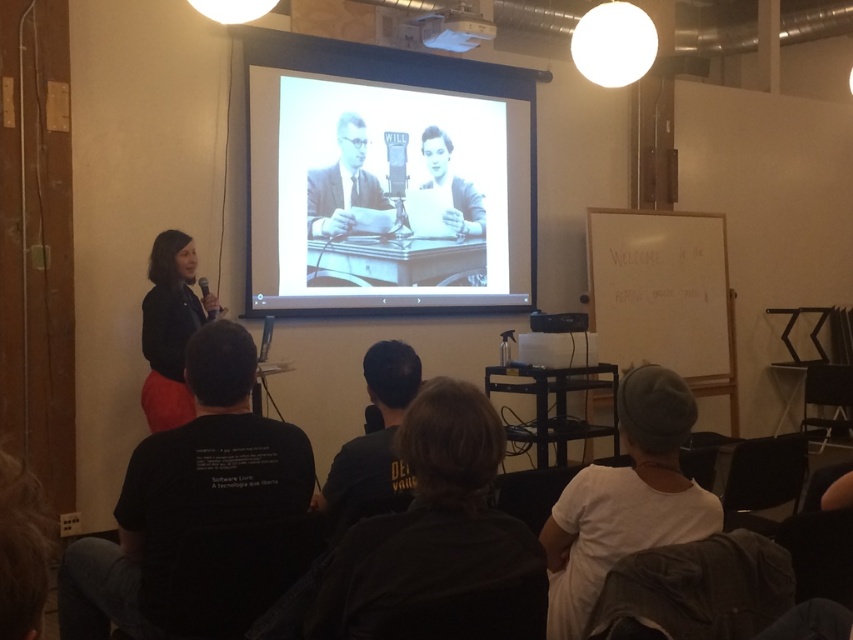
Which is more to the right, white glossy projection screen at center or matte black jacket at left?

white glossy projection screen at center

Measure the distance between white glossy projection screen at center and camera.

14.55 feet

This screenshot has width=853, height=640. I want to click on white glossy projection screen at center, so pyautogui.click(x=390, y=189).

Between white glossy projection screen at center and white plastic projector at upper center, which one has less height?

Standing shorter between the two is white plastic projector at upper center.

In the scene shown: Who is positioned more to the right, white glossy projection screen at center or white plastic projector at upper center?

From the viewer's perspective, white plastic projector at upper center appears more on the right side.

Does point (334, 262) lie in front of point (480, 32)?

Yes, it is.

Where is `white glossy projection screen at center`? white glossy projection screen at center is located at coordinates (390, 189).

Between black cotton t-shirt at left and matte black jacket at left, which one appears on the left side from the viewer's perspective?

From the viewer's perspective, matte black jacket at left appears more on the left side.

Who is shorter, black cotton t-shirt at left or matte black jacket at left?

Standing shorter between the two is black cotton t-shirt at left.

What do you see at coordinates (184, 492) in the screenshot? I see `black cotton t-shirt at left` at bounding box center [184, 492].

Locate an element on the screen. The width and height of the screenshot is (853, 640). black cotton t-shirt at left is located at coordinates (184, 492).